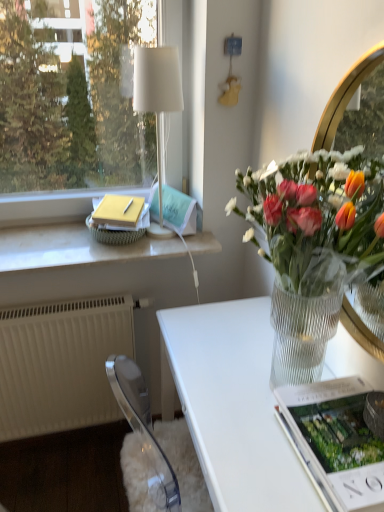
Question: Is clear gold mirror at upper right looking in the opposite direction of white plastic radiator at lower left?

Choices:
 (A) yes
 (B) no

Answer: (B)

Question: Can you confirm if clear gold mirror at upper right is smaller than white plastic radiator at lower left?

Choices:
 (A) no
 (B) yes

Answer: (B)

Question: From a real-world perspective, is clear gold mirror at upper right located higher than white plastic radiator at lower left?

Choices:
 (A) no
 (B) yes

Answer: (B)

Question: From the image's perspective, is clear gold mirror at upper right above white plastic radiator at lower left?

Choices:
 (A) no
 (B) yes

Answer: (B)

Question: Is clear gold mirror at upper right taller than white plastic radiator at lower left?

Choices:
 (A) no
 (B) yes

Answer: (B)

Question: Can you confirm if clear gold mirror at upper right is positioned to the left of white plastic radiator at lower left?

Choices:
 (A) no
 (B) yes

Answer: (A)

Question: Considering the relative sizes of matte green magazine at upper center, which is the 2th magazine in bottom-to-top order, and white plastic radiator at lower left in the image provided, is matte green magazine at upper center, which is the 2th magazine in bottom-to-top order, shorter than white plastic radiator at lower left?

Choices:
 (A) no
 (B) yes

Answer: (B)

Question: Is white plastic radiator at lower left at the back of matte green magazine at upper center, which is the 2th magazine in bottom-to-top order?

Choices:
 (A) yes
 (B) no

Answer: (B)

Question: Is matte green magazine at upper center, which is the 2th magazine in front-to-back order, at the right side of white plastic radiator at lower left?

Choices:
 (A) no
 (B) yes

Answer: (B)

Question: Does matte green magazine at upper center, which is the 1th magazine from top to bottom, have a greater width compared to white plastic radiator at lower left?

Choices:
 (A) yes
 (B) no

Answer: (B)

Question: Is matte green magazine at upper center, which appears as the 2th magazine when viewed from the right, in front of white plastic radiator at lower left?

Choices:
 (A) no
 (B) yes

Answer: (A)

Question: Are matte green magazine at upper center, the first magazine positioned from the left, and white plastic radiator at lower left far apart?

Choices:
 (A) no
 (B) yes

Answer: (A)

Question: Considering the relative sizes of matte green magazine at upper center, which is the 1th magazine from top to bottom, and matte white magazine at lower right, which appears as the 2th magazine when viewed from the back, in the image provided, is matte green magazine at upper center, which is the 1th magazine from top to bottom, smaller than matte white magazine at lower right, which appears as the 2th magazine when viewed from the back,?

Choices:
 (A) no
 (B) yes

Answer: (B)